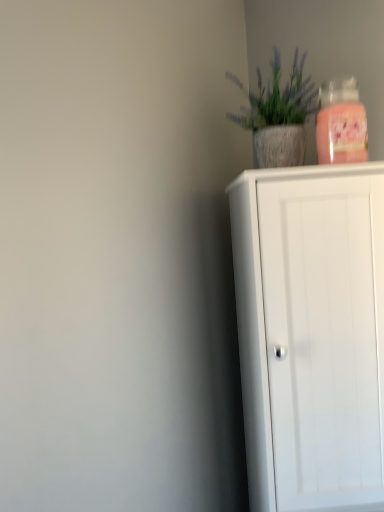
Question: From the image's perspective, is textured concrete pot at upper right positioned above or below white matte cabinet at right?

Choices:
 (A) below
 (B) above

Answer: (B)

Question: Is point (256, 71) closer or farther from the camera than point (354, 222)?

Choices:
 (A) closer
 (B) farther

Answer: (B)

Question: Considering the positions of textured concrete pot at upper right and white matte cabinet at right in the image, is textured concrete pot at upper right bigger or smaller than white matte cabinet at right?

Choices:
 (A) big
 (B) small

Answer: (B)

Question: In terms of height, does white matte cabinet at right look taller or shorter compared to textured concrete pot at upper right?

Choices:
 (A) tall
 (B) short

Answer: (A)

Question: Considering their positions, is white matte cabinet at right located in front of or behind textured concrete pot at upper right?

Choices:
 (A) front
 (B) behind

Answer: (A)

Question: Is white matte cabinet at right inside the boundaries of textured concrete pot at upper right, or outside?

Choices:
 (A) inside
 (B) outside

Answer: (B)

Question: From the image's perspective, is white matte cabinet at right above or below textured concrete pot at upper right?

Choices:
 (A) below
 (B) above

Answer: (A)